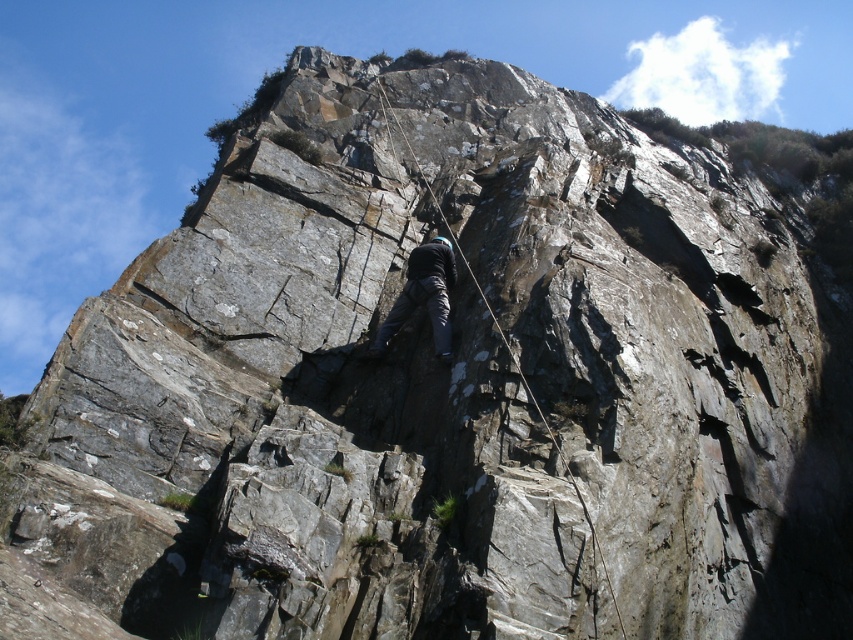
You are a photographer aiming to capture the rock climber without any obstructions. Given that you can adjust your camera angle, which object between the dark blue fabric at center and the rope at center should you avoid framing in front of the climber?

The rope at center is behind the dark blue fabric at center, so to avoid obstructions, you should ensure the dark blue fabric at center is not placed in front of the climber in the frame.

In the scene shown: You are a hiker planning to climb the cliff shown in the image. You have a dark blue fabric at center and a rope at center available. Which item would you choose to secure your footing on the steep cliff face?

The rope at center is larger in size compared to the dark blue fabric at center, making it more suitable for securing footing on the steep cliff face.